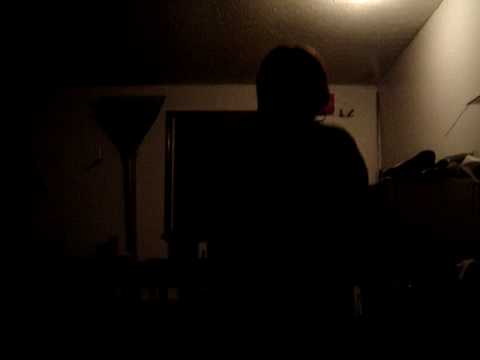
Where is `light`? Image resolution: width=480 pixels, height=360 pixels. light is located at coordinates (363, 4).